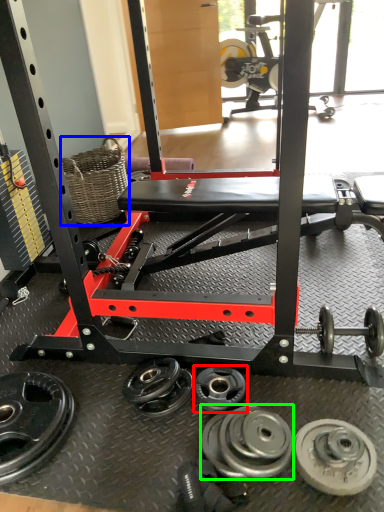
Question: Which object is positioned farthest from wheel (highlighted by a red box)? Select from basket (highlighted by a blue box) and wheel (highlighted by a green box).

Choices:
 (A) basket
 (B) wheel

Answer: (A)